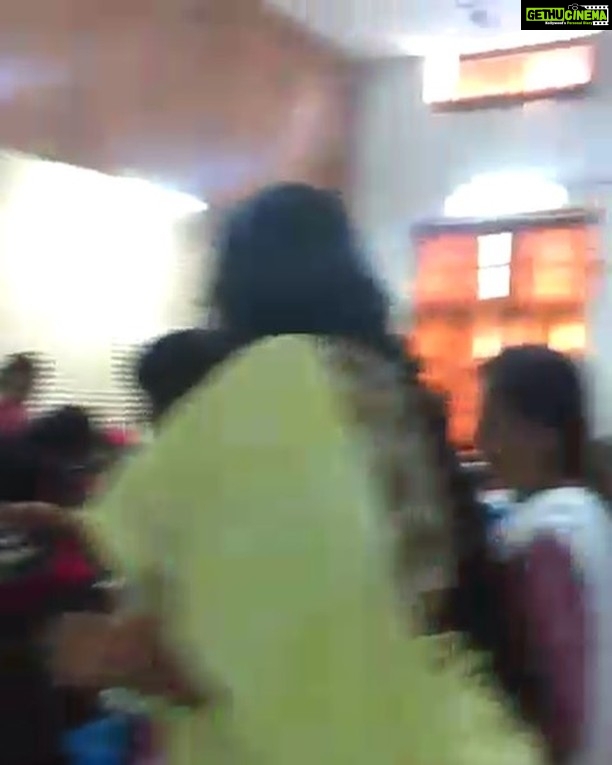
Where is `curtains`? The width and height of the screenshot is (612, 765). curtains is located at coordinates (456, 267), (579, 272), (465, 359), (542, 330).